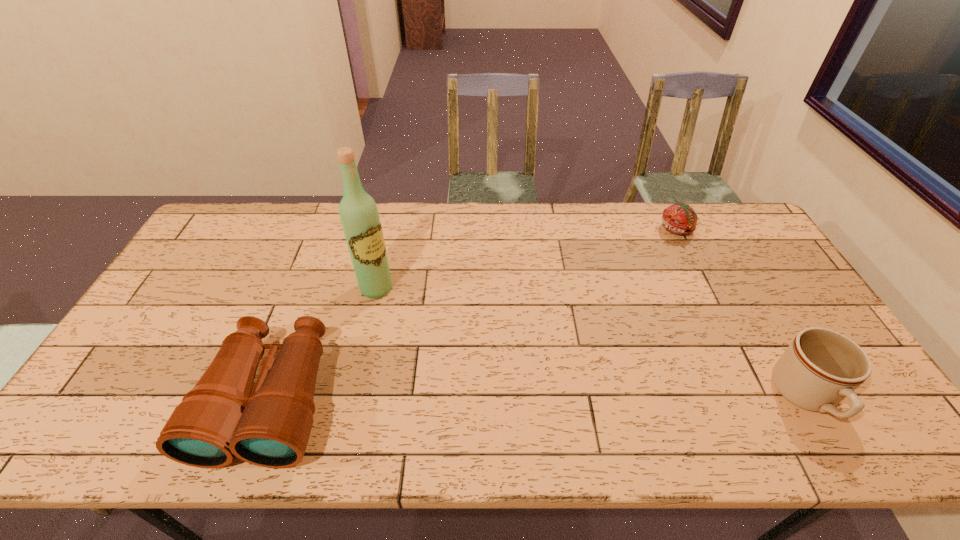
At what (x,y) coordinates should I click in order to perform the action: click on free space at the far left corner. Please return your answer as a coordinate pair (x, y). The width and height of the screenshot is (960, 540). Looking at the image, I should click on (222, 218).

Where is `free area in between the mug and the binoculars`? free area in between the mug and the binoculars is located at coordinates 539,399.

Locate an element on the screen. Image resolution: width=960 pixels, height=540 pixels. free space between the binoculars and the mug is located at coordinates (539, 399).

The image size is (960, 540). In order to click on empty space between the binoculars and the tallest object in this screenshot , I will do `click(324, 344)`.

Where is `free spot between the tomato and the third nearest object`? free spot between the tomato and the third nearest object is located at coordinates (527, 259).

Locate an element on the screen. vacant area that lies between the shortest object and the binoculars is located at coordinates (474, 314).

The height and width of the screenshot is (540, 960). What are the coordinates of `vacant area between the binoculars and the third nearest object` in the screenshot? It's located at (324, 344).

Image resolution: width=960 pixels, height=540 pixels. What are the coordinates of `free area in between the farthest object and the third nearest object` in the screenshot? It's located at click(x=527, y=259).

Where is `free spot between the tallest object and the mug`? This screenshot has width=960, height=540. free spot between the tallest object and the mug is located at coordinates (591, 342).

Find the location of a particular element. The image size is (960, 540). free space that is in between the shortest object and the binoculars is located at coordinates (474, 314).